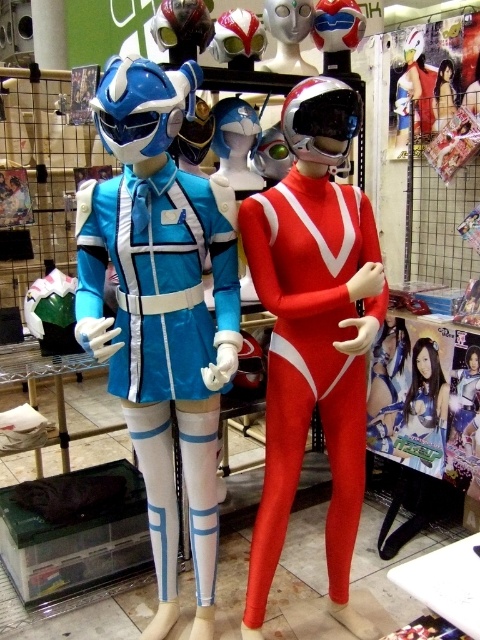
You are a customer in a superhero costume store. You see the shiny red spandex suit at center and the shiny silver helmet at center. Which one is closer to you?

The shiny red spandex suit at center is closer to you because it is in front of the shiny silver helmet at center.